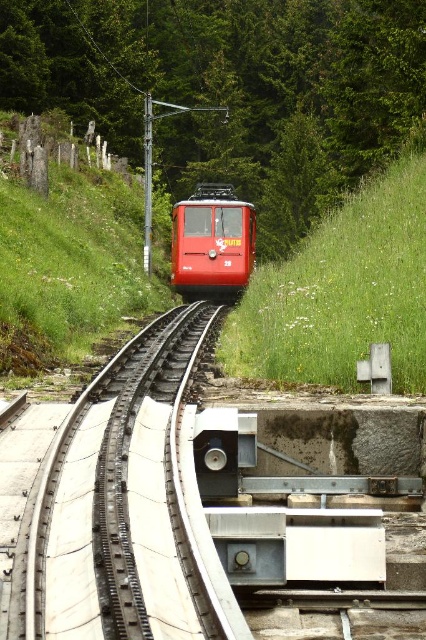
You are a passenger in the red cable car marked 28 heading up the mountain. You notice two points marked on the track ahead. The first point is at coordinates point (195, 424) and the second point is at point (236, 253). Which point will the cable car reach first?

The cable car will reach point (195, 424) first because it is positioned in front of point (236, 253) along the track.

You are a passenger on the shiny red train at center and want to know if the entire length of the train is visible on the metallic gray train track at center. Based on the scene, can you confirm?

The metallic gray train track at center is shorter than the shiny red train at center, so the entire length of the train cannot be fully visible on the track.

You are standing at the base of the mountain and looking up at the cable car track. There are two points marked on the track. Which point is closer to you, point [230,349] or point [221,182]?

Point [230,349] is closer to the viewer than point [221,182].